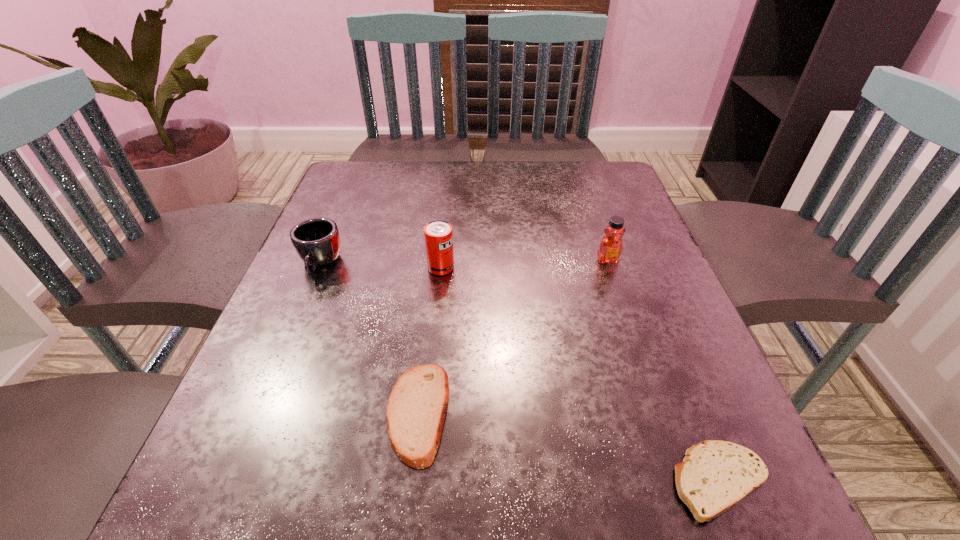
Locate an element on the screen. can is located at coordinates tap(438, 234).

This screenshot has height=540, width=960. I want to click on honey, so click(x=611, y=246).

The image size is (960, 540). I want to click on the leftmost object, so click(316, 240).

Where is `mug`? mug is located at coordinates (316, 240).

At what (x,y) coordinates should I click in order to perform the action: click on the left pita bread. Please return your answer as a coordinate pair (x, y). Looking at the image, I should click on (416, 409).

This screenshot has width=960, height=540. I want to click on the taller pita bread, so click(416, 409).

Find the location of `the shortest object`. the shortest object is located at coordinates pos(715,475).

Locate an element on the screen. the shorter pita bread is located at coordinates (715, 475).

This screenshot has height=540, width=960. In order to click on free space located 0.190m on the back of the can in this screenshot , I will do `click(446, 210)`.

Where is `vacant region located 0.060m on the front label of the honey`? The image size is (960, 540). vacant region located 0.060m on the front label of the honey is located at coordinates (616, 287).